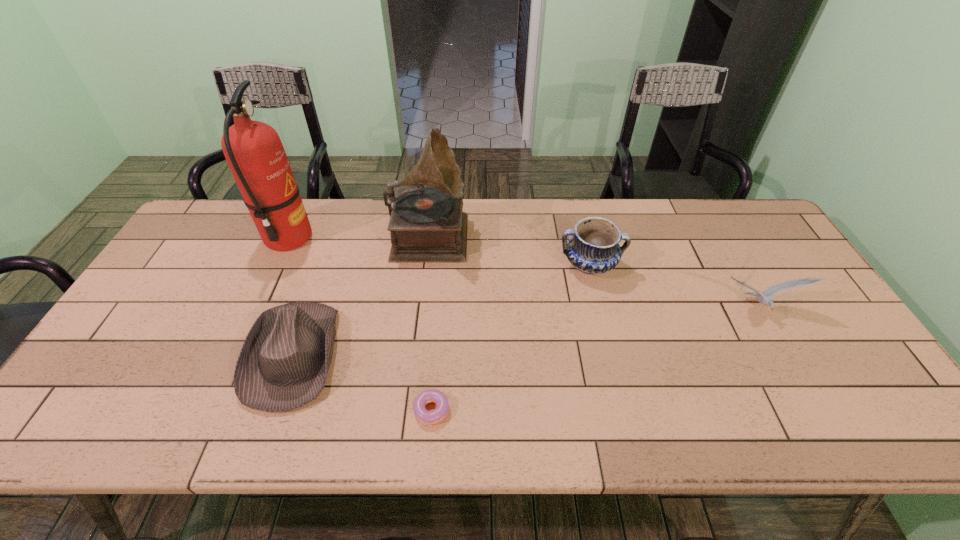
The image size is (960, 540). In order to click on vacant region located 0.390m on the right of the fedora in this screenshot , I will do `click(495, 354)`.

At what (x,y) coordinates should I click in order to perform the action: click on vacant region located on the right of the shortest object. Please return your answer as a coordinate pair (x, y). The width and height of the screenshot is (960, 540). Looking at the image, I should click on (520, 409).

Image resolution: width=960 pixels, height=540 pixels. I want to click on fire extinguisher present at the far edge, so click(x=253, y=150).

Locate an element on the screen. Image resolution: width=960 pixels, height=540 pixels. record player that is positioned at the far edge is located at coordinates (427, 225).

Where is `fedora positioned at the near edge`? The image size is (960, 540). fedora positioned at the near edge is located at coordinates (283, 364).

Find the location of a particular element. doughnut that is positioned at the near edge is located at coordinates (422, 414).

Where is `object located at the right edge`? object located at the right edge is located at coordinates (x=766, y=299).

Find the location of `vacant space at the far edge of the desktop`. vacant space at the far edge of the desktop is located at coordinates (558, 223).

Where is `vacant space at the near edge of the desktop`? vacant space at the near edge of the desktop is located at coordinates (512, 409).

Locate an element on the screen. free space at the left edge of the desktop is located at coordinates (183, 322).